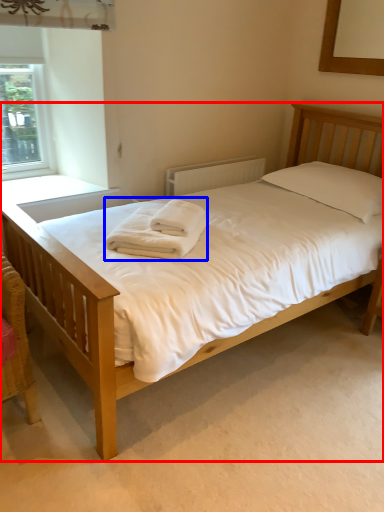
Question: Which object appears farthest to the camera in this image, bed (highlighted by a red box) or bath towel (highlighted by a blue box)?

Choices:
 (A) bed
 (B) bath towel

Answer: (B)